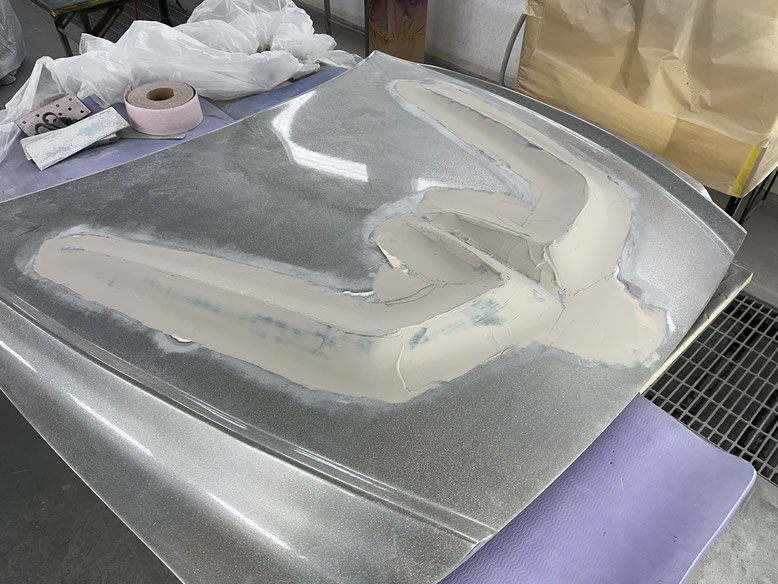
The image size is (778, 584). In order to click on lilac colored yoga mat in this screenshot , I will do `click(615, 523)`.